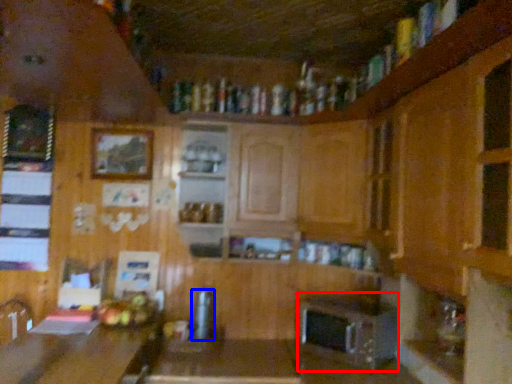
Question: Which of the following is the farthest to the observer, appliance (highlighted by a red box) or appliance (highlighted by a blue box)?

Choices:
 (A) appliance
 (B) appliance

Answer: (B)